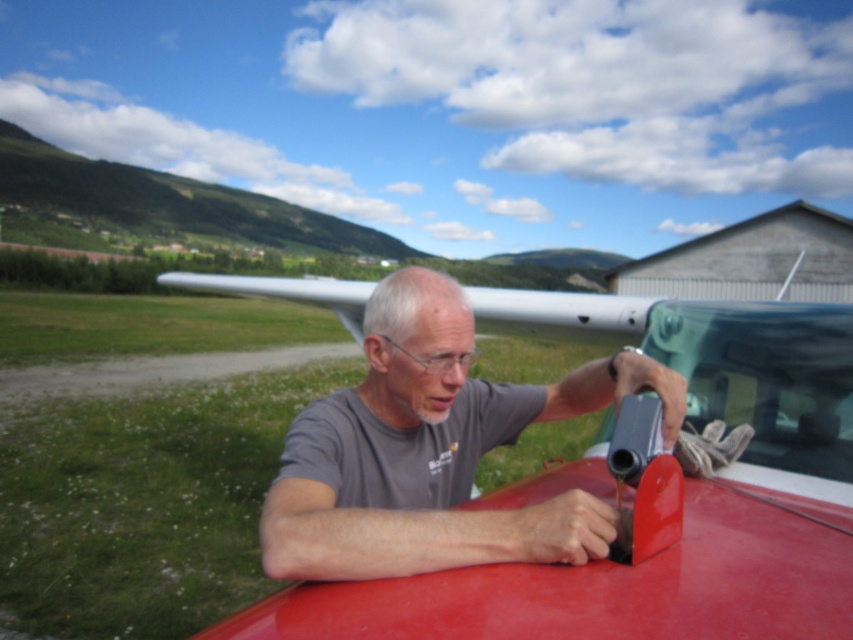
Is point (418, 476) farther from viewer compared to point (811, 394)?

No, it is not.

Does gray matte shirt at center appear over transparent glass windshield at center?

Actually, gray matte shirt at center is below transparent glass windshield at center.

Is point (350, 508) more distant than point (786, 426)?

No, (350, 508) is closer to viewer.

Locate an element on the screen. gray matte shirt at center is located at coordinates pyautogui.click(x=433, y=451).